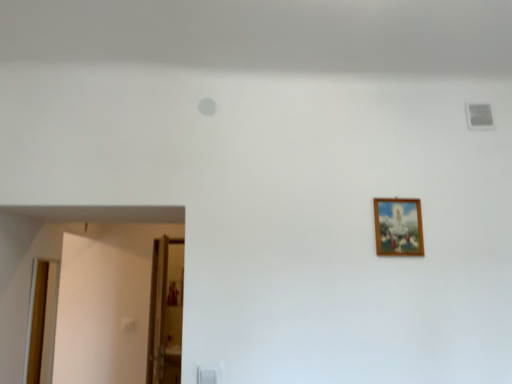
Measure the distance between wooden frame at upper right and camera.

wooden frame at upper right and camera are 6.62 feet apart.

Locate an element on the screen. This screenshot has width=512, height=384. wooden door at lower left, the second door when ordered from left to right is located at coordinates (103, 308).

Is wooden door at left, which is the 2th door in right-to-left order, oriented towards transparent glass door at lower left?

No, wooden door at left, which is the 2th door in right-to-left order, is not facing towards transparent glass door at lower left.

From the image's perspective, is wooden door at left, which is the 2th door in right-to-left order, below transparent glass door at lower left?

No, from the image's perspective, wooden door at left, which is the 2th door in right-to-left order, is not below transparent glass door at lower left.

This screenshot has height=384, width=512. I want to click on glass door below the wooden door at left, which is the 2th door in right-to-left order (from the image's perspective), so click(x=165, y=312).

Where is `door to the right of wooden door at left, the 1th door in the left-to-right sequence`? This screenshot has width=512, height=384. door to the right of wooden door at left, the 1th door in the left-to-right sequence is located at coordinates (103, 308).

Is wooden door at lower left, the first door viewed from the right, bigger than wooden door at left, which is the 2th door in right-to-left order?

Correct, wooden door at lower left, the first door viewed from the right, is larger in size than wooden door at left, which is the 2th door in right-to-left order.

Considering the sizes of objects wooden door at lower left, the second door when ordered from left to right, and wooden door at left, the 1th door in the left-to-right sequence, in the image provided, who is wider, wooden door at lower left, the second door when ordered from left to right, or wooden door at left, the 1th door in the left-to-right sequence,?

With larger width is wooden door at left, the 1th door in the left-to-right sequence.

From a real-world perspective, is transparent glass door at lower left physically above wooden door at left, which is the 2th door in right-to-left order?

Actually, transparent glass door at lower left is physically below wooden door at left, which is the 2th door in right-to-left order, in the real world.

Is transparent glass door at lower left bigger or smaller than wooden door at left, which is the 2th door in right-to-left order?

Considering their sizes, transparent glass door at lower left takes up more space than wooden door at left, which is the 2th door in right-to-left order.

Which is behind, point (156, 256) or point (37, 381)?

Positioned behind is point (156, 256).

Is transparent glass door at lower left turned away from wooden door at left, which is the 2th door in right-to-left order?

No, transparent glass door at lower left's orientation is not away from wooden door at left, which is the 2th door in right-to-left order.

From the image's perspective, who appears lower, wooden frame at upper right or transparent glass door at lower left?

From the image's view, transparent glass door at lower left is below.

Considering the positions of objects wooden frame at upper right and transparent glass door at lower left in the image provided, who is in front, wooden frame at upper right or transparent glass door at lower left?

wooden frame at upper right.

How much distance is there between wooden frame at upper right and transparent glass door at lower left?

wooden frame at upper right and transparent glass door at lower left are 2.32 meters apart from each other.

Looking at this image, considering the sizes of wooden frame at upper right and transparent glass door at lower left in the image, is wooden frame at upper right taller or shorter than transparent glass door at lower left?

wooden frame at upper right is shorter than transparent glass door at lower left.

Is wooden door at left, which is the 2th door in right-to-left order, positioned beyond the bounds of wooden frame at upper right?

Indeed, wooden door at left, which is the 2th door in right-to-left order, is completely outside wooden frame at upper right.

Based on their sizes in the image, would you say wooden door at left, which is the 2th door in right-to-left order, is bigger or smaller than wooden frame at upper right?

wooden door at left, which is the 2th door in right-to-left order, is bigger than wooden frame at upper right.

Which point is more forward, (48, 292) or (377, 213)?

The point (377, 213) is closer to the camera.

Which of these two, wooden door at left, the 1th door in the left-to-right sequence, or wooden frame at upper right, stands shorter?

wooden frame at upper right.

Can you see wooden door at left, the 1th door in the left-to-right sequence, touching wooden door at lower left, the first door viewed from the right?

They are not placed beside each other.

Does wooden door at left, the 1th door in the left-to-right sequence, have a greater height compared to wooden door at lower left, the first door viewed from the right?

No, wooden door at left, the 1th door in the left-to-right sequence, is not taller than wooden door at lower left, the first door viewed from the right.

From the image's perspective, between wooden door at left, which is the 2th door in right-to-left order, and wooden door at lower left, the first door viewed from the right, which one is located above?

wooden door at lower left, the first door viewed from the right.

Is wooden door at lower left, the second door when ordered from left to right, located outside transparent glass door at lower left?

wooden door at lower left, the second door when ordered from left to right, is positioned outside transparent glass door at lower left.

The height and width of the screenshot is (384, 512). Identify the location of the 2nd door above the transparent glass door at lower left (from the image's perspective). (103, 308).

From a real-world perspective, who is located lower, wooden door at lower left, the first door viewed from the right, or transparent glass door at lower left?

transparent glass door at lower left, from a real-world perspective.

Find the location of a particular element. The image size is (512, 384). glass door on the right side of wooden door at left, the 1th door in the left-to-right sequence is located at coordinates pyautogui.click(x=165, y=312).

Where is `door above the wooden door at left, the 1th door in the left-to-right sequence (from a real-world perspective)`? The image size is (512, 384). door above the wooden door at left, the 1th door in the left-to-right sequence (from a real-world perspective) is located at coordinates (103, 308).

Which object lies further to the anchor point wooden door at left, the 1th door in the left-to-right sequence, transparent glass door at lower left or wooden door at lower left, the first door viewed from the right?

The object further to wooden door at left, the 1th door in the left-to-right sequence, is transparent glass door at lower left.

Based on their spatial positions, is wooden door at lower left, the first door viewed from the right, or wooden frame at upper right further from wooden door at left, which is the 2th door in right-to-left order?

wooden frame at upper right is positioned further to the anchor wooden door at left, which is the 2th door in right-to-left order.

Considering their positions, is wooden frame at upper right positioned closer to wooden door at lower left, the second door when ordered from left to right, than wooden door at left, which is the 2th door in right-to-left order?

Among the two, wooden door at left, which is the 2th door in right-to-left order, is located nearer to wooden door at lower left, the second door when ordered from left to right.

From the image, which object appears to be farther from transparent glass door at lower left, wooden door at left, which is the 2th door in right-to-left order, or wooden frame at upper right?

wooden frame at upper right.

From the image, which object appears to be farther from transparent glass door at lower left, wooden door at lower left, the first door viewed from the right, or wooden frame at upper right?

wooden frame at upper right is further to transparent glass door at lower left.

Looking at the image, which one is located further to wooden frame at upper right, wooden door at left, which is the 2th door in right-to-left order, or wooden door at lower left, the first door viewed from the right?

wooden door at left, which is the 2th door in right-to-left order, lies further to wooden frame at upper right than the other object.

Based on their spatial positions, is wooden frame at upper right or transparent glass door at lower left further from wooden door at lower left, the second door when ordered from left to right?

Among the two, wooden frame at upper right is located further to wooden door at lower left, the second door when ordered from left to right.

Looking at the image, which one is located closer to wooden frame at upper right, wooden door at left, the 1th door in the left-to-right sequence, or transparent glass door at lower left?

transparent glass door at lower left is positioned closer to the anchor wooden frame at upper right.

The height and width of the screenshot is (384, 512). I want to click on door between wooden door at left, which is the 2th door in right-to-left order, and transparent glass door at lower left in the front-back direction, so click(103, 308).

You are a GUI agent. You are given a task and a screenshot of the screen. Output one action in this format:
    pyautogui.click(x=<x>, y=<y>)
    Task: Click on the glass door situated between wooden door at left, which is the 2th door in right-to-left order, and wooden frame at upper right from left to right
    This screenshot has width=512, height=384.
    Given the screenshot: What is the action you would take?
    pyautogui.click(x=165, y=312)

Where is `door between wooden door at left, the 1th door in the left-to-right sequence, and wooden frame at upper right, in the horizontal direction`? Image resolution: width=512 pixels, height=384 pixels. door between wooden door at left, the 1th door in the left-to-right sequence, and wooden frame at upper right, in the horizontal direction is located at coordinates (103, 308).

Find the location of `glass door located between wooden door at lower left, the first door viewed from the right, and wooden frame at upper right in the left-right direction`. glass door located between wooden door at lower left, the first door viewed from the right, and wooden frame at upper right in the left-right direction is located at coordinates (165, 312).